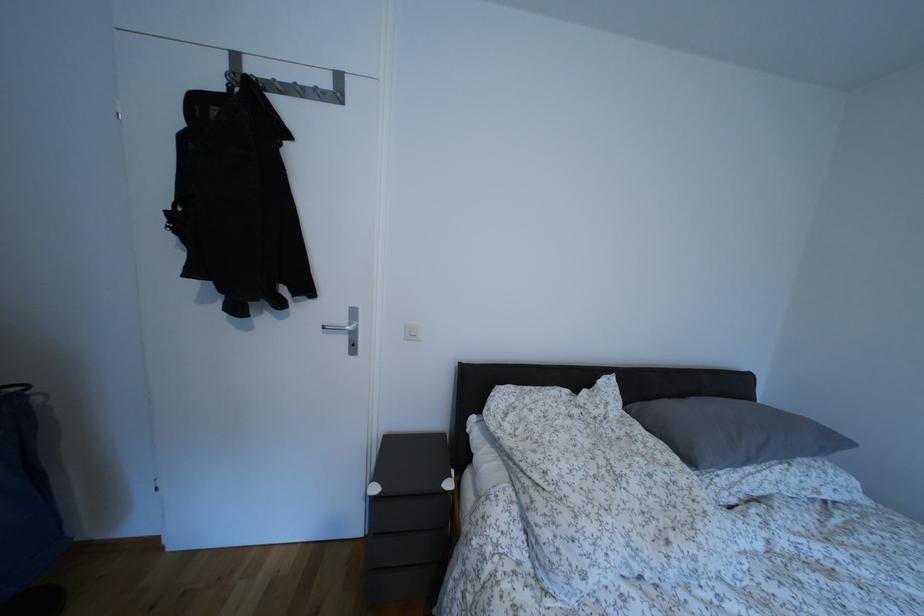
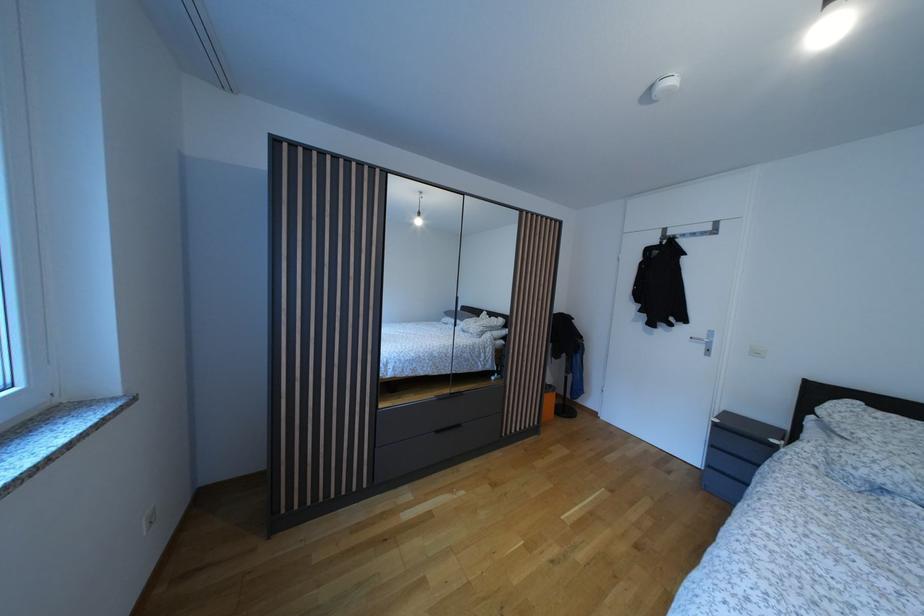
The point at (348,325) is marked in the first image. Where is the corresponding point in the second image?

(709, 342)